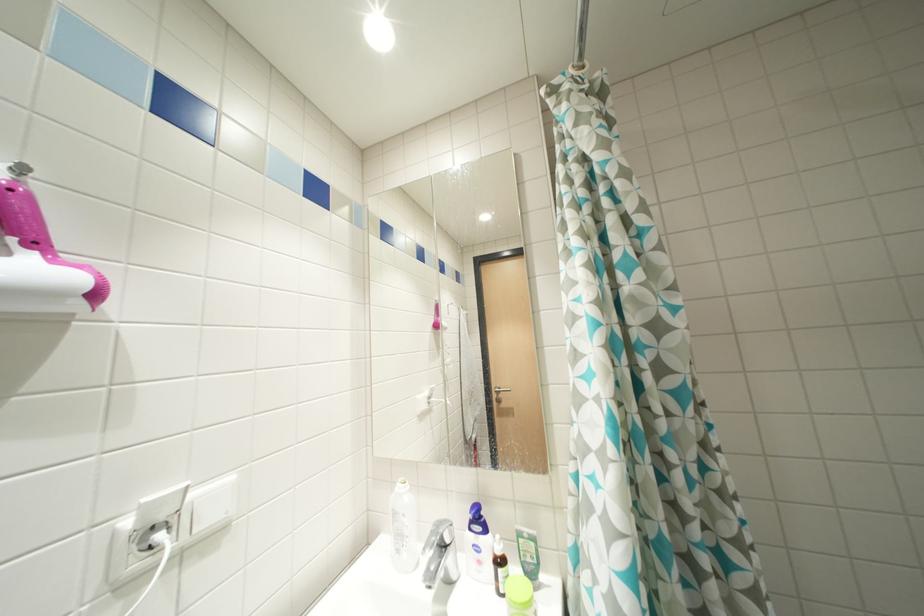
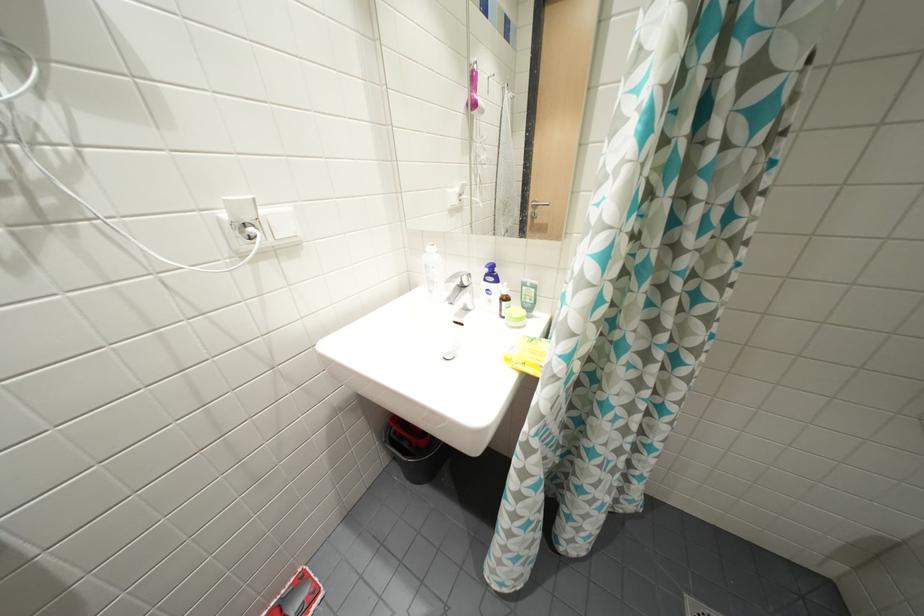
Question: How did the camera likely rotate?

Choices:
 (A) Left
 (B) Right
 (C) Up
 (D) Down

Answer: (D)